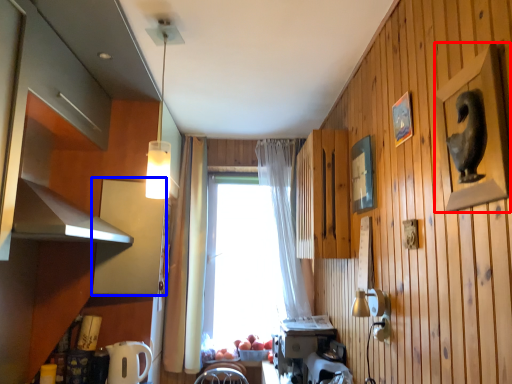
Question: Which object is closer to the camera taking this photo, picture frame (highlighted by a red box) or cabinetry (highlighted by a blue box)?

Choices:
 (A) picture frame
 (B) cabinetry

Answer: (A)